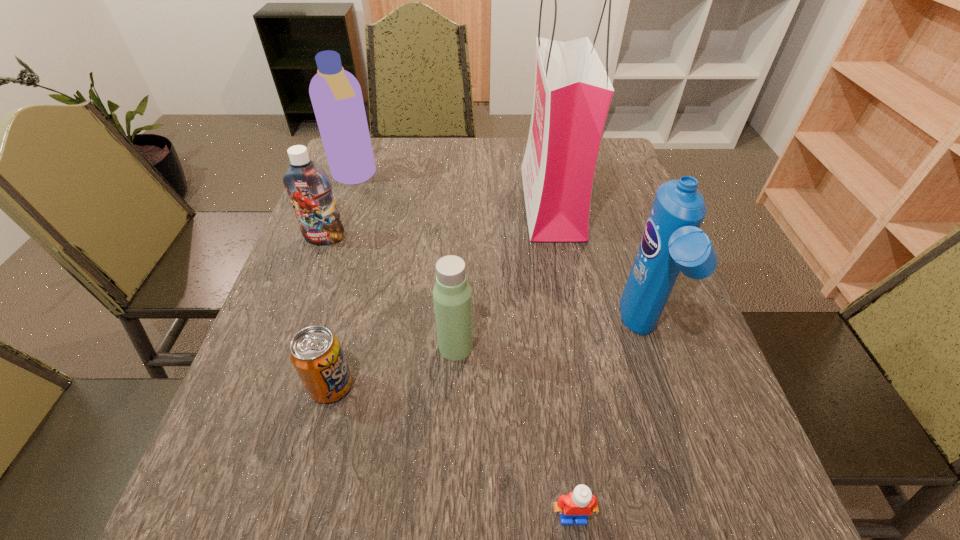
This screenshot has height=540, width=960. Identify the location of the tallest object. (572, 93).

Identify the location of the farthest shampoo. (336, 96).

Identify the location of the nearest shampoo. This screenshot has height=540, width=960. (672, 241).

Locate an element on the screen. The image size is (960, 540). the rightmost shampoo is located at coordinates (672, 241).

Locate an element on the screen. the shortest shampoo is located at coordinates (309, 188).

You are a GUI agent. You are given a task and a screenshot of the screen. Output one action in this format:
    pyautogui.click(x=<x>, y=<y>)
    Task: Click on the fourth object from left to right
    
    Given the screenshot: What is the action you would take?
    pyautogui.click(x=452, y=295)

The width and height of the screenshot is (960, 540). Find the location of `soda can`. soda can is located at coordinates (315, 352).

Find the location of `the nearest object`. the nearest object is located at coordinates (580, 503).

At what (x,y) coordinates should I click in order to perform the action: click on the shortest object. Please return your answer as a coordinate pair (x, y). Looking at the image, I should click on 580,503.

The width and height of the screenshot is (960, 540). In order to click on free spot located on the front-facing side of the shopping bag in this screenshot , I will do 482,202.